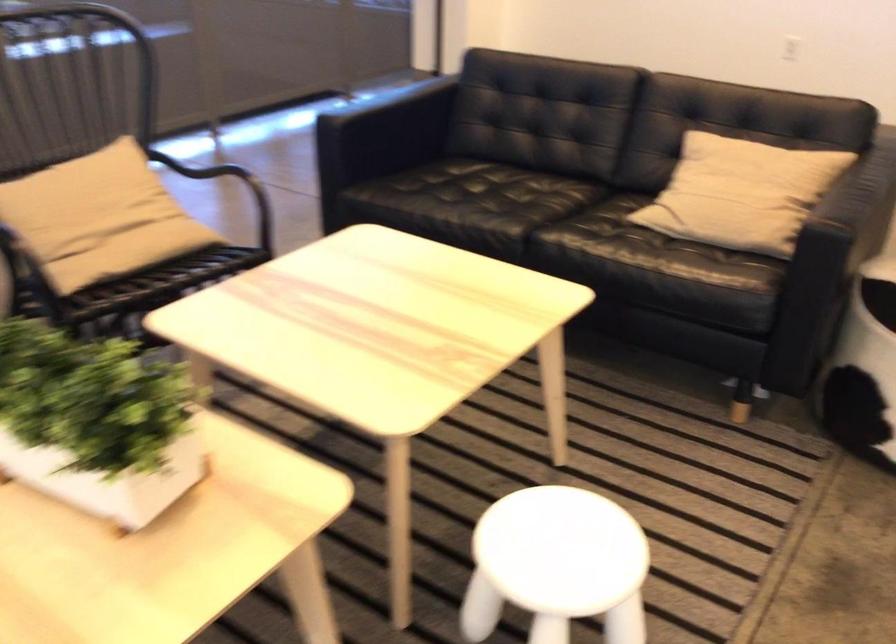
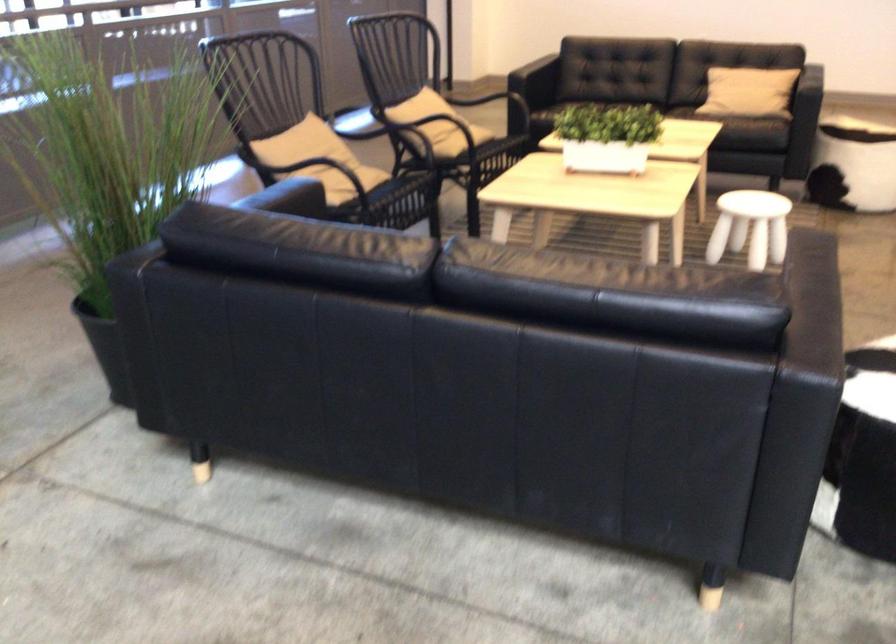
Find the pixel in the second image that matches the point at 72,417 in the first image.

(607, 137)